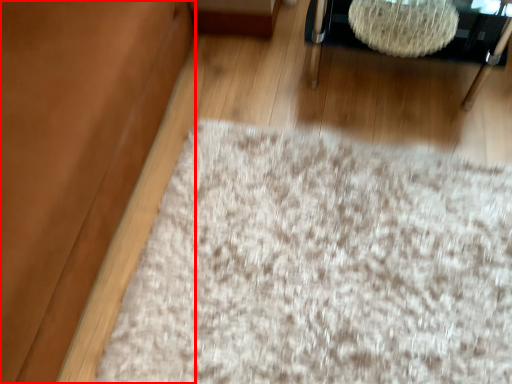
Question: From the image's perspective, considering the relative positions of couch (annotated by the red box) and furniture in the image provided, where is couch (annotated by the red box) located with respect to the staircase?

Choices:
 (A) above
 (B) below

Answer: (B)